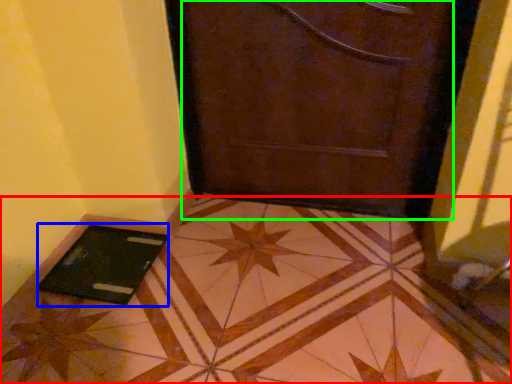
Question: Based on their relative distances, which object is farther from tile (highlighted by a red box)? Choose from tablet computer (highlighted by a blue box) and door (highlighted by a green box).

Choices:
 (A) tablet computer
 (B) door

Answer: (B)